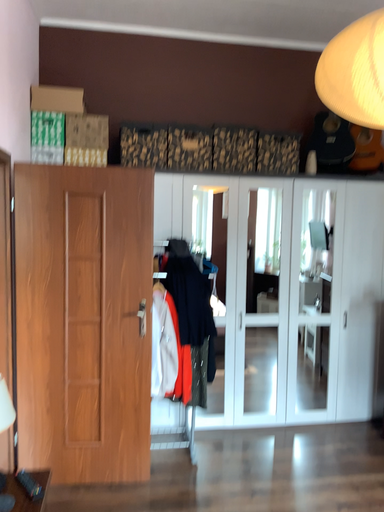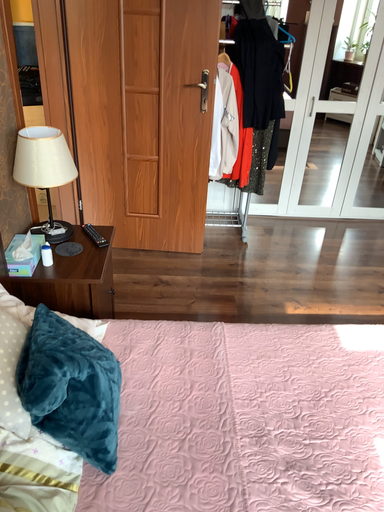
Question: How did the camera likely rotate when shooting the video?

Choices:
 (A) rotated right
 (B) rotated left

Answer: (B)